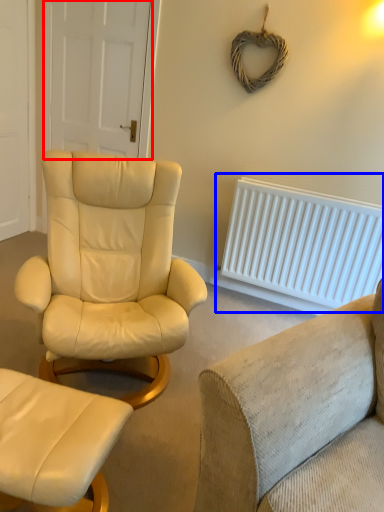
Question: Which point is further to the camera, door (highlighted by a red box) or radiator (highlighted by a blue box)?

Choices:
 (A) door
 (B) radiator

Answer: (A)